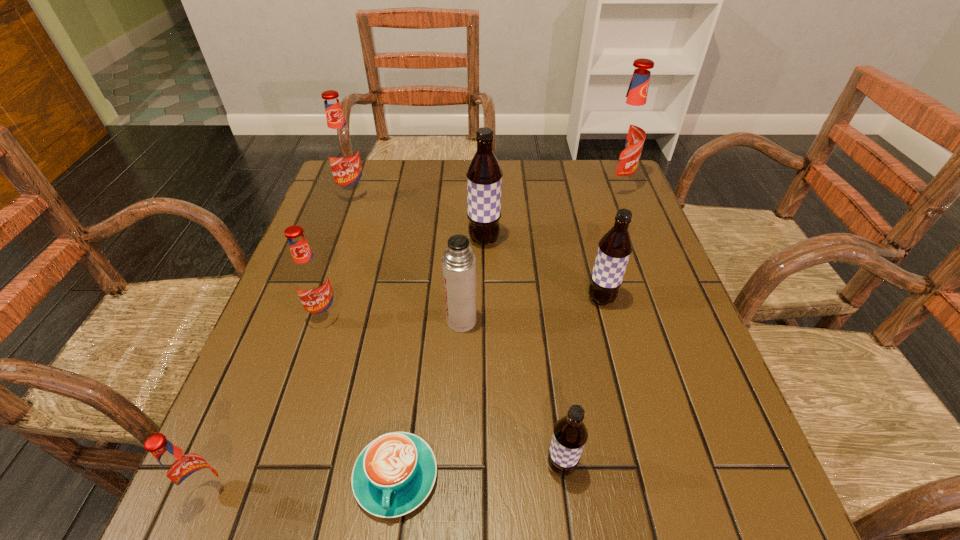
Locate an element on the screen. The width and height of the screenshot is (960, 540). the tallest object is located at coordinates (627, 131).

The height and width of the screenshot is (540, 960). In order to click on the biggest red root beer in this screenshot , I will do `click(627, 131)`.

Locate an element on the screen. The height and width of the screenshot is (540, 960). the second biggest red root beer is located at coordinates (342, 149).

The width and height of the screenshot is (960, 540). In order to click on the biggest brown root beer in this screenshot , I will do `click(484, 175)`.

The image size is (960, 540). In order to click on the farthest brown root beer in this screenshot , I will do `click(484, 175)`.

This screenshot has width=960, height=540. I want to click on the third farthest red root beer, so click(311, 280).

The width and height of the screenshot is (960, 540). Identify the location of the second smallest brown root beer. (615, 247).

You are a GUI agent. You are given a task and a screenshot of the screen. Output one action in this format:
    pyautogui.click(x=<x>, y=<y>)
    Task: Click on the second root beer from right to left
    This screenshot has width=960, height=540.
    Given the screenshot: What is the action you would take?
    pyautogui.click(x=615, y=247)

Identify the location of thermos bottle. (458, 262).

This screenshot has width=960, height=540. In order to click on the nearest brown root beer in this screenshot , I will do `click(570, 434)`.